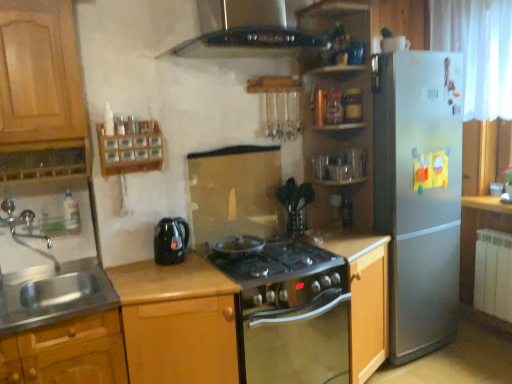
Image resolution: width=512 pixels, height=384 pixels. Find the location of `vacant space in front of black glossy electric kettle at center-left`. vacant space in front of black glossy electric kettle at center-left is located at coordinates (168, 274).